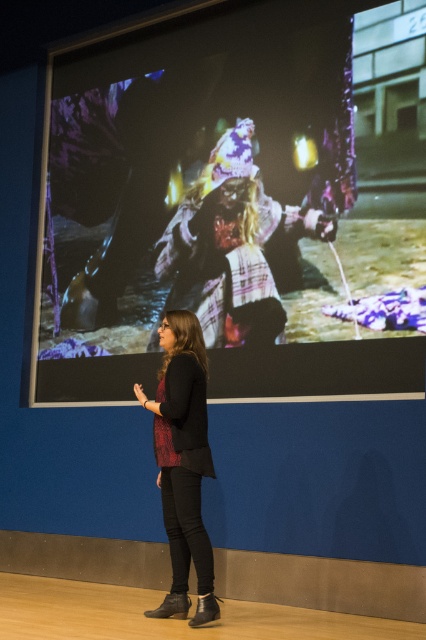
Question: Where is matte black screen at center located in relation to matte black pants at center in the image?

Choices:
 (A) left
 (B) right

Answer: (B)

Question: Which object is closer to the camera taking this photo?

Choices:
 (A) matte black pants at center
 (B) matte black screen at center

Answer: (A)

Question: Among these points, which one is farthest from the camera?

Choices:
 (A) (158, 376)
 (B) (270, 186)

Answer: (B)

Question: Among these objects, which one is farthest from the camera?

Choices:
 (A) matte black screen at center
 (B) matte black pants at center

Answer: (A)

Question: Is matte black screen at center positioned at the back of matte black pants at center?

Choices:
 (A) yes
 (B) no

Answer: (A)

Question: Is the position of matte black screen at center less distant than that of matte black pants at center?

Choices:
 (A) yes
 (B) no

Answer: (B)